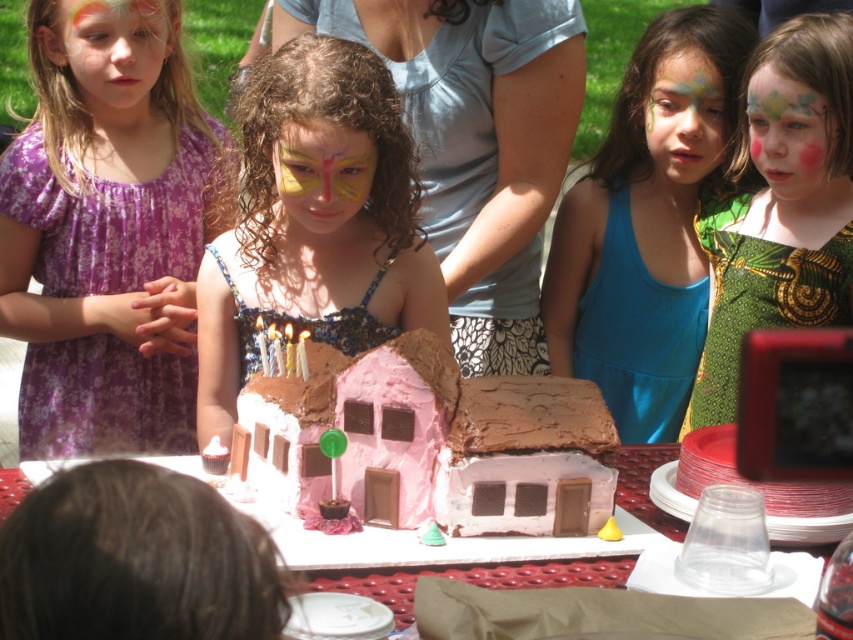
Is pink chocolate house at center positioned behind green textured dress at center?

No, pink chocolate house at center is in front of green textured dress at center.

Can you confirm if pink chocolate house at center is positioned to the right of green textured dress at center?

In fact, pink chocolate house at center is to the left of green textured dress at center.

Is point (407, 396) behind point (827, 275)?

No, (407, 396) is closer to viewer.

Where is `pink chocolate house at center`? pink chocolate house at center is located at coordinates (434, 440).

Which is more to the left, smooth white table at center or pastel rainbow face paint at upper left?

pastel rainbow face paint at upper left

The height and width of the screenshot is (640, 853). I want to click on smooth white table at center, so click(471, 579).

Is point (428, 564) behind point (103, 93)?

No, (428, 564) is in front of (103, 93).

You are a GUI agent. You are given a task and a screenshot of the screen. Output one action in this format:
    pyautogui.click(x=<x>, y=<y>)
    Task: Click on the smooth white table at center
    Image resolution: width=853 pixels, height=640 pixels.
    Given the screenshot: What is the action you would take?
    point(471,579)

Is point (711, 20) positioned after point (646, 109)?

No.

Where is `blue fabric dress at center`? This screenshot has height=640, width=853. blue fabric dress at center is located at coordinates (646, 225).

The height and width of the screenshot is (640, 853). Find the location of `blue fabric dress at center`. blue fabric dress at center is located at coordinates (646, 225).